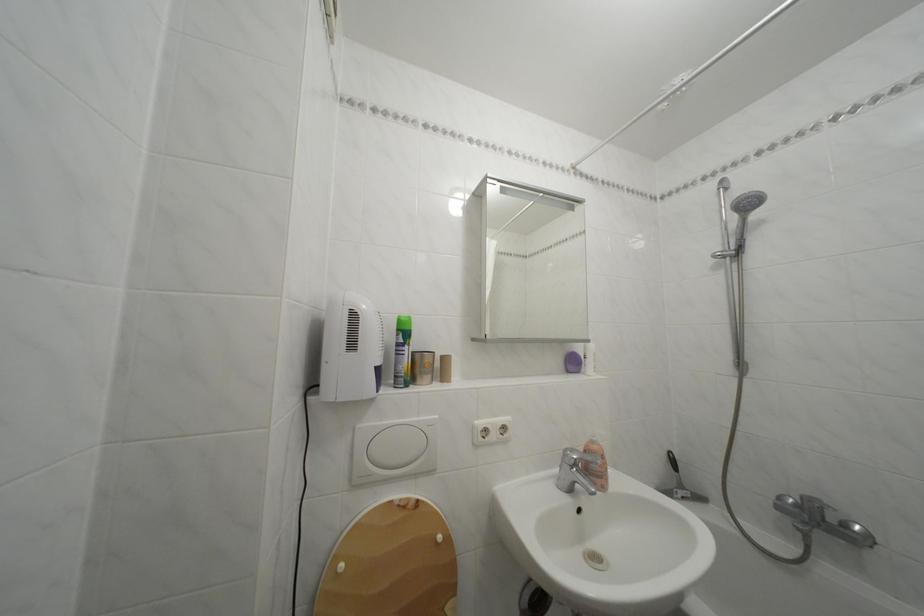
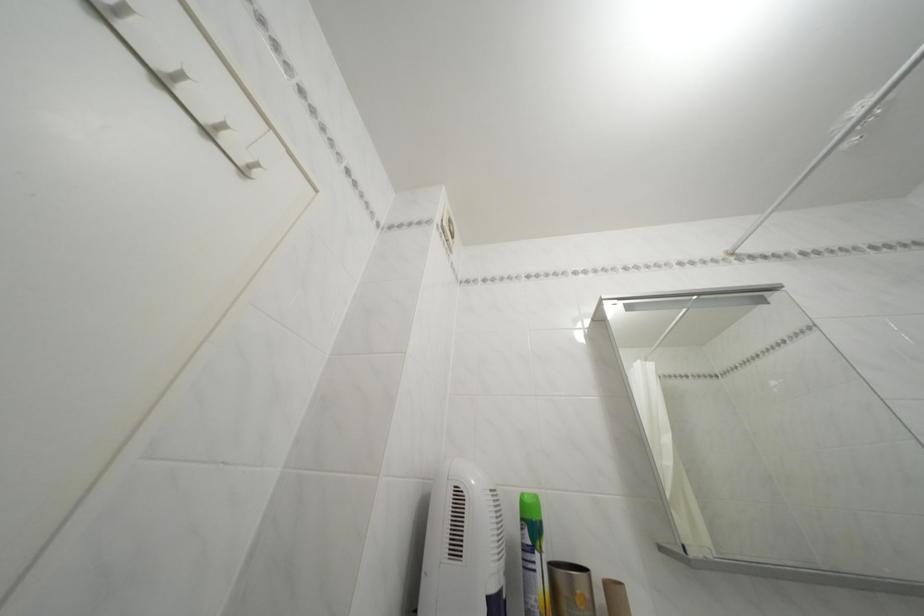
In the second image, find the point that corresponds to the point at 689,84 in the first image.

(869, 114)